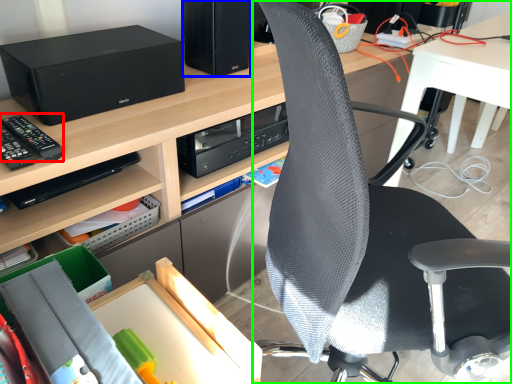
Question: Estimate the real-world distances between objects in this image. Which object is farther from equipment (highlighted by a red box), computer tower (highlighted by a blue box) or chair (highlighted by a green box)?

Choices:
 (A) computer tower
 (B) chair

Answer: (B)